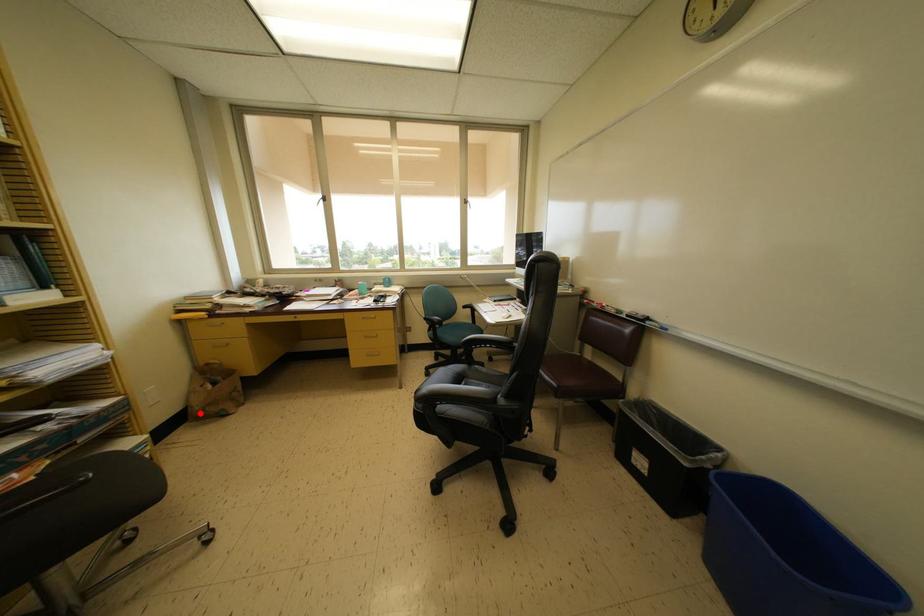
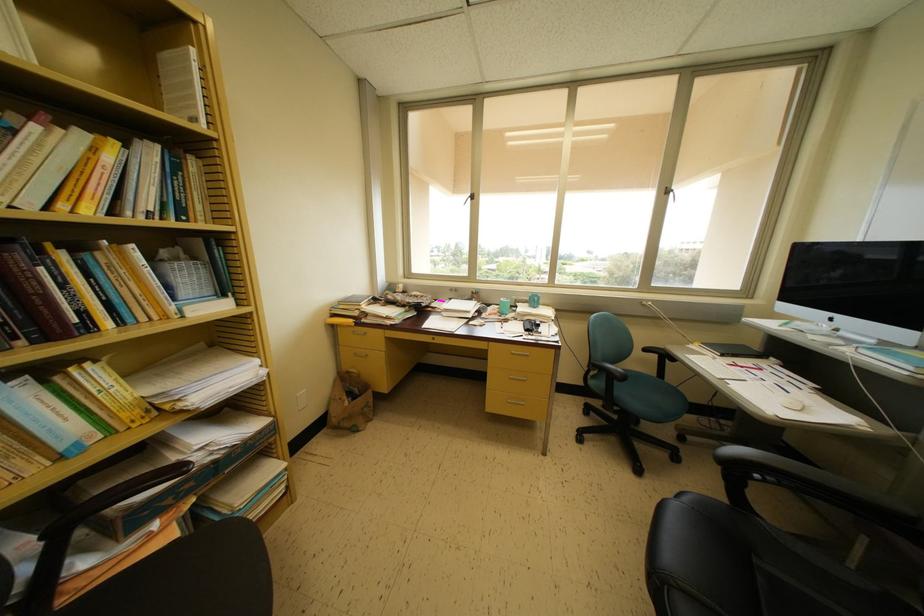
Question: I am providing you with two images of the same scene from different viewpoints. In image1, a red point is highlighted. Considering the same 3D point in image2, which of the following is correct?

Choices:
 (A) It is closer
 (B) It is farther

Answer: (B)